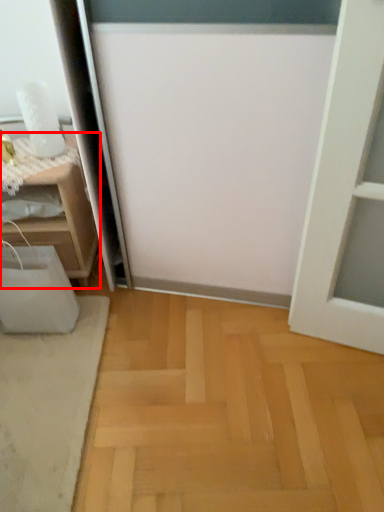
Question: From the image's perspective, where is furniture (annotated by the red box) located relative to doormat?

Choices:
 (A) above
 (B) below

Answer: (A)